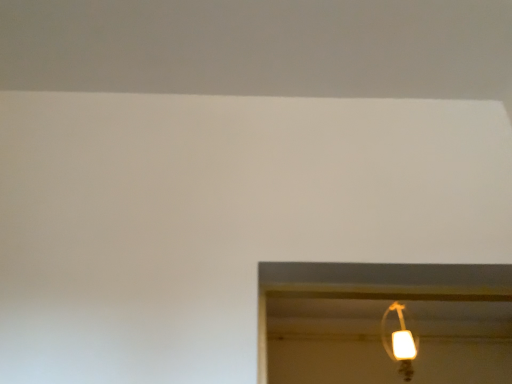
Locate an element on the screen. This screenshot has width=512, height=384. matte white lamp at upper right is located at coordinates (400, 342).

The width and height of the screenshot is (512, 384). What do you see at coordinates (400, 342) in the screenshot? I see `matte white lamp at upper right` at bounding box center [400, 342].

Where is `matte white lamp at upper right`? matte white lamp at upper right is located at coordinates (400, 342).